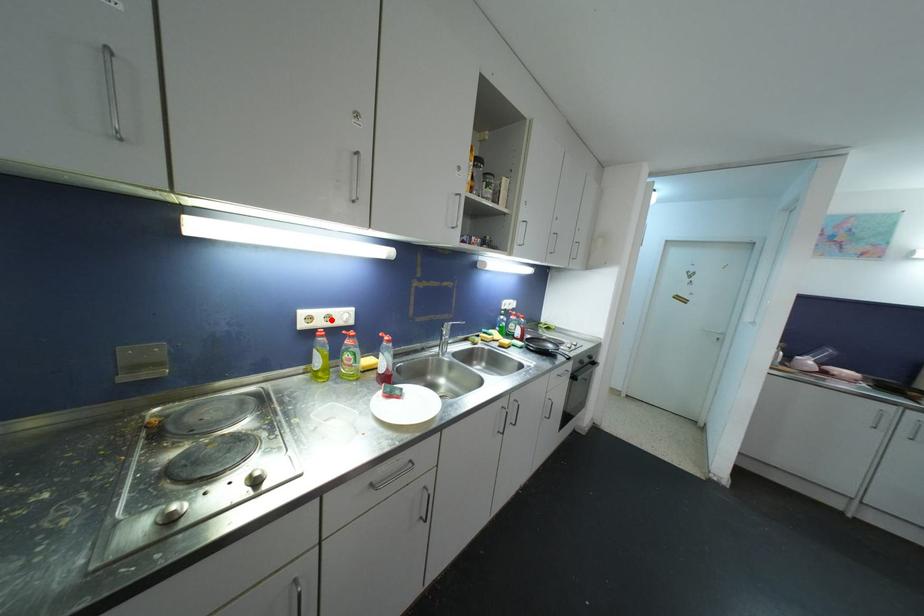
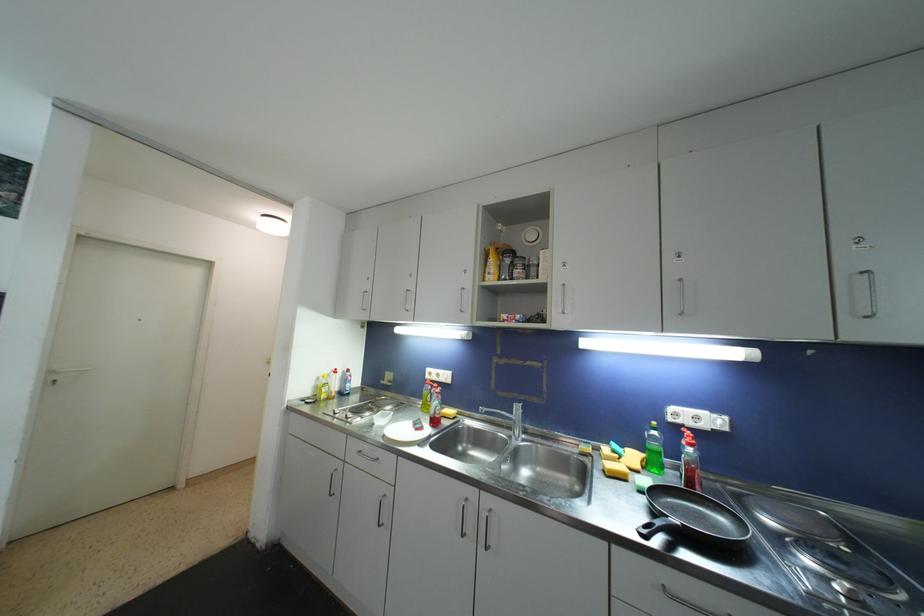
In the second image, find the point that corresponds to the highlighted location in the first image.

(441, 378)